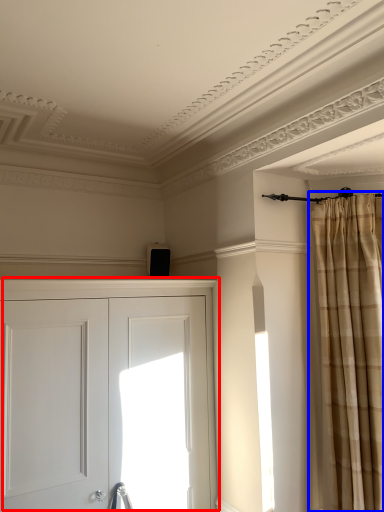
Question: Which object appears closest to the camera in this image, door (highlighted by a red box) or curtain (highlighted by a blue box)?

Choices:
 (A) door
 (B) curtain

Answer: (A)